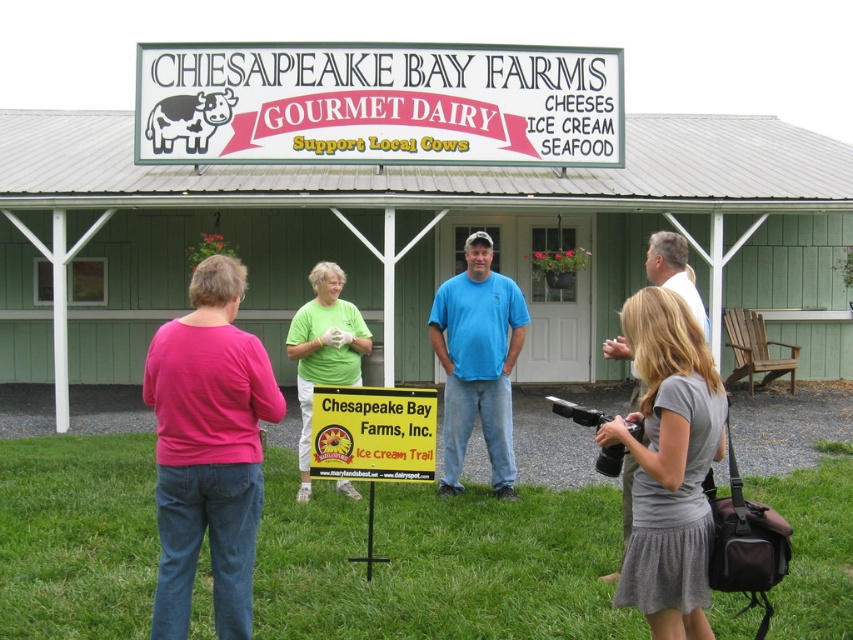
You are a visitor at Chesapeake Bay Farms and see the blue cotton shirt at center and the yellow paper sign at center. Which one is positioned to the right of the other?

The blue cotton shirt at center is to the right of the yellow paper sign at center.

You are a photographer trying to capture a photo of the yellow paper sign at center and the green matte shirt at center. The camera you are using has a minimum focus distance of 5 feet. Will both subjects be in focus if you position yourself exactly between them?

The yellow paper sign at center and green matte shirt at center are 5.28 feet apart. Since the camera requires a minimum focus distance of 5 feet, positioning yourself exactly between them would mean each subject is 2.64 feet away. This distance is below the camera requirement, so both subjects would not be in focus.